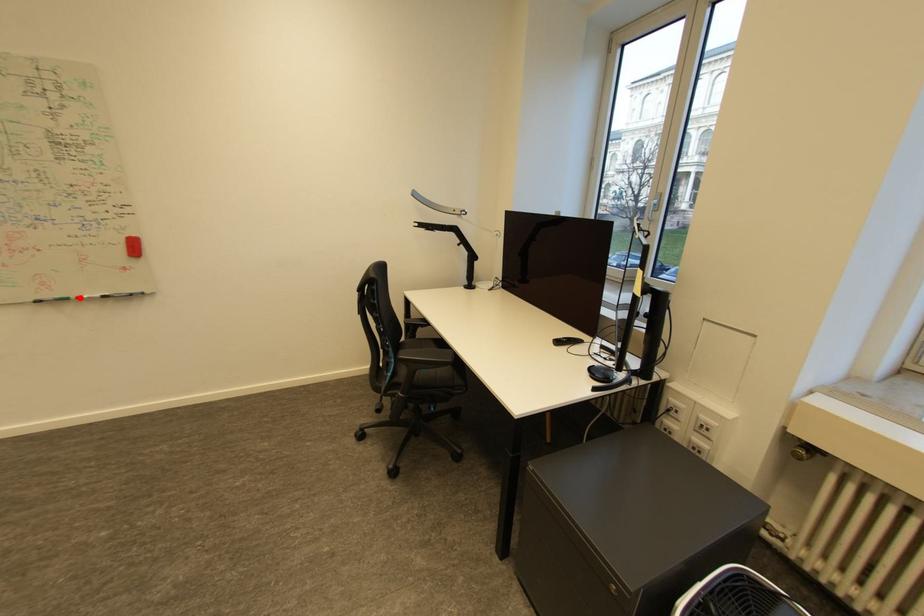
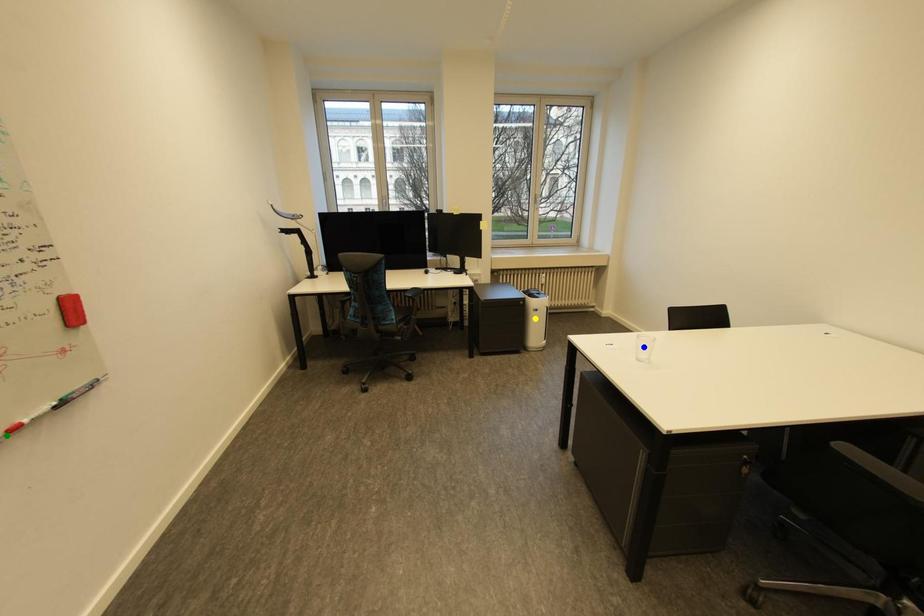
Question: I am providing you with two images of the same scene from different viewpoints. A red point is marked on the first image. You are given multiple points on the second image. Can you choose the point in image 2 that corresponds to the point in image 1?

Choices:
 (A) blue point
 (B) green point
 (C) yellow point

Answer: (B)